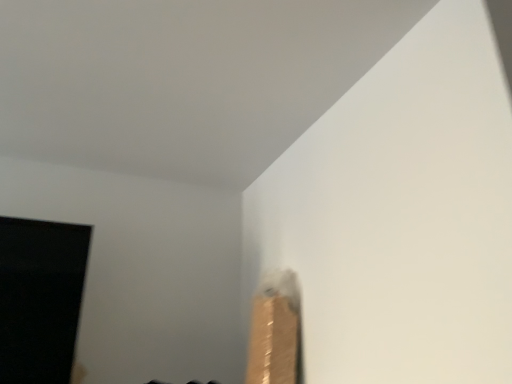
In order to face wooden pencil at upper right, should I rotate leftwards or rightwards?

You should rotate right by 1.908 degrees.

The height and width of the screenshot is (384, 512). What do you see at coordinates (274, 330) in the screenshot? I see `wooden pencil at upper right` at bounding box center [274, 330].

Where is `wooden pencil at upper right`? The width and height of the screenshot is (512, 384). wooden pencil at upper right is located at coordinates (274, 330).

The width and height of the screenshot is (512, 384). Identify the location of wooden pencil at upper right. (274, 330).